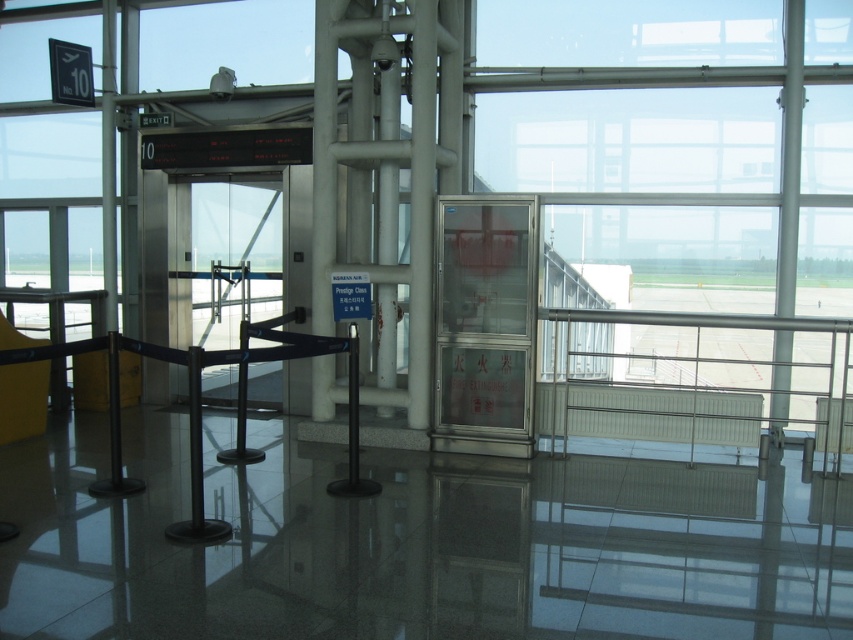
Looking at this image, you are a passenger who just noticed the transparent glass window at center and the transparent glass fire extinguisher at center. Which one is located to the right side of the other?

The transparent glass window at center is located to the right of the transparent glass fire extinguisher at center.

You are standing in the airport terminal near the gate area. You see two points marked as point (608,196) and point (503,400). Which point is closer to you?

Point (608,196) is closer to you because it is further to the viewer than point (503,400).

You are a passenger standing at the gate area in the airport terminal. You notice two items at the center of your view. One is the transparent glass window at center and the other is the transparent glass fire extinguisher at center. Which of these two items is taller?

The transparent glass window at center is taller than the transparent glass fire extinguisher at center according to the description.